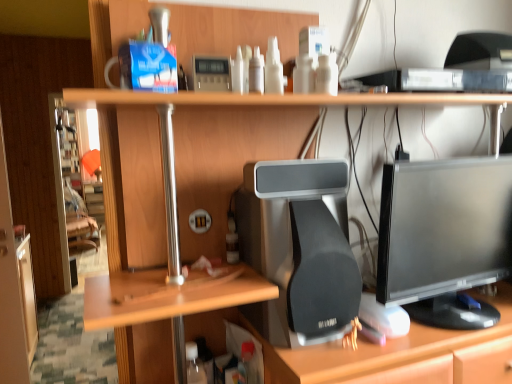
Locate an element on the screen. This screenshot has height=384, width=512. wooden desk at center is located at coordinates (227, 106).

At what (x,y) coordinates should I click in order to perform the action: click on wooden desk at center. Please return your answer as a coordinate pair (x, y). Looking at the image, I should click on (227, 106).

Can you confirm if wooden desk at center is taller than matte black desktop computer at center?

Correct, wooden desk at center is much taller as matte black desktop computer at center.

Looking at this image, considering the relative sizes of wooden desk at center and matte black desktop computer at center in the image provided, is wooden desk at center thinner than matte black desktop computer at center?

Incorrect, the width of wooden desk at center is not less than that of matte black desktop computer at center.

Considering the positions of objects wooden desk at center and matte black desktop computer at center in the image provided, who is behind, wooden desk at center or matte black desktop computer at center?

matte black desktop computer at center is behind.

Is wooden desk at center far away from matte black desktop computer at center?

wooden desk at center is actually quite close to matte black desktop computer at center.

Which is more to the right, matte black desktop computer at center or black glossy monitor at center right?

From the viewer's perspective, black glossy monitor at center right appears more on the right side.

In the scene shown: From a real-world perspective, does matte black desktop computer at center stand above black glossy monitor at center right?

Actually, matte black desktop computer at center is physically below black glossy monitor at center right in the real world.

Can you confirm if matte black desktop computer at center is bigger than black glossy monitor at center right?

No.

At what (x,y) coordinates should I click in order to perform the action: click on desktop computer that appears on the left of black glossy monitor at center right. Please return your answer as a coordinate pair (x, y). Looking at the image, I should click on (301, 244).

Is matte black desktop computer at center with wooden desk at center?

matte black desktop computer at center and wooden desk at center are not in contact.

Which is closer to the camera, (331,290) or (194,93)?

Point (194,93)

From a real-world perspective, is matte black desktop computer at center positioned under wooden desk at center based on gravity?

Incorrect, from a real-world perspective, matte black desktop computer at center is higher than wooden desk at center.

Would you say matte black desktop computer at center is outside wooden desk at center?

Actually, matte black desktop computer at center is at least partially inside wooden desk at center.

Is black glossy monitor at center right positioned with its back to matte black desktop computer at center?

That's not correct — black glossy monitor at center right is not looking away from matte black desktop computer at center.

In the image, is black glossy monitor at center right positioned in front of or behind matte black desktop computer at center?

black glossy monitor at center right is positioned closer to the viewer than matte black desktop computer at center.

Considering the sizes of black glossy monitor at center right and matte black desktop computer at center in the image, is black glossy monitor at center right bigger or smaller than matte black desktop computer at center?

black glossy monitor at center right is bigger than matte black desktop computer at center.

Which is more to the left, black glossy monitor at center right or matte black desktop computer at center?

matte black desktop computer at center is more to the left.

In the scene shown: Measure the distance from wooden desk at center to black glossy monitor at center right.

31.54 centimeters.

Can you tell me how much wooden desk at center and black glossy monitor at center right differ in facing direction?

The facing directions of wooden desk at center and black glossy monitor at center right are 1.27 degrees apart.

Which is nearer, (511, 313) or (460, 206)?

Clearly, point (511, 313) is more distant from the camera than point (460, 206).

Consider the image. Between wooden desk at center and black glossy monitor at center right, which one appears on the left side from the viewer's perspective?

wooden desk at center.

Can you confirm if black glossy monitor at center right is positioned to the right of wooden desk at center?

Correct, you'll find black glossy monitor at center right to the right of wooden desk at center.

Looking at their sizes, would you say black glossy monitor at center right is wider or thinner than wooden desk at center?

black glossy monitor at center right is thinner than wooden desk at center.

Is wooden desk at center inside black glossy monitor at center right?

Actually, wooden desk at center is outside black glossy monitor at center right.

Locate an element on the screen. desktop computer that is above the wooden desk at center (from the image's perspective) is located at coordinates (301, 244).

Locate an element on the screen. computer monitor in front of the matte black desktop computer at center is located at coordinates (444, 238).

Estimate the real-world distances between objects in this image. Which object is closer to black glossy monitor at center right, wooden desk at center or matte black desktop computer at center?

matte black desktop computer at center is closer to black glossy monitor at center right.

Looking at the image, which one is located further to black glossy monitor at center right, matte black desktop computer at center or wooden desk at center?

wooden desk at center lies further to black glossy monitor at center right than the other object.

When comparing their distances from matte black desktop computer at center, does wooden desk at center or black glossy monitor at center right seem further?

wooden desk at center lies further to matte black desktop computer at center than the other object.

Estimate the real-world distances between objects in this image. Which object is further from wooden desk at center, matte black desktop computer at center or black glossy monitor at center right?

Among the two, black glossy monitor at center right is located further to wooden desk at center.

Estimate the real-world distances between objects in this image. Which object is closer to wooden desk at center, black glossy monitor at center right or matte black desktop computer at center?

matte black desktop computer at center.

Looking at the image, which one is located closer to matte black desktop computer at center, black glossy monitor at center right or wooden desk at center?

Based on the image, black glossy monitor at center right appears to be nearer to matte black desktop computer at center.

At what (x,y) coordinates should I click in order to perform the action: click on desk located between matte black desktop computer at center and black glossy monitor at center right in the left-right direction. Please return your answer as a coordinate pair (x, y). The width and height of the screenshot is (512, 384). Looking at the image, I should click on (227, 106).